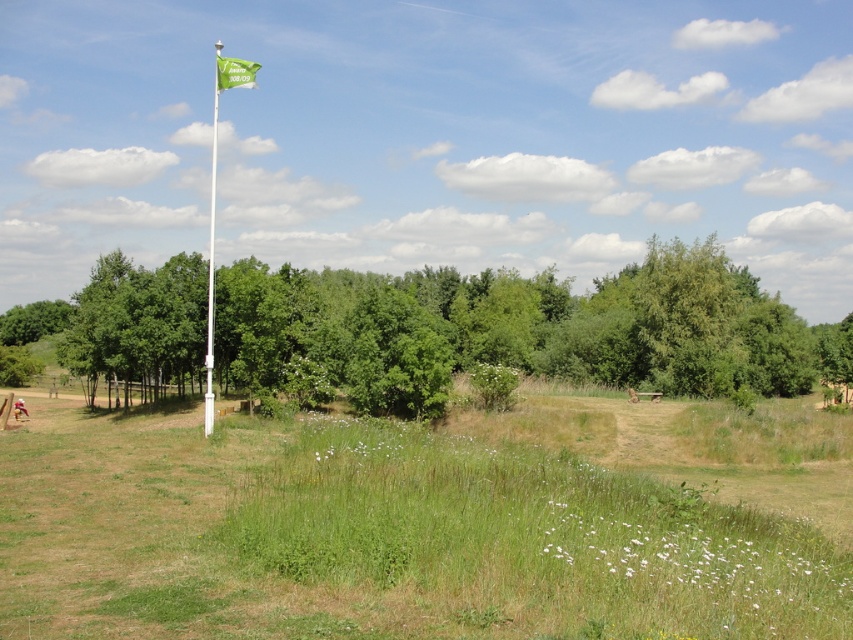
Question: Which object appears farthest from the camera in this image?

Choices:
 (A) white plastic flag pole at center
 (B) green leafy tree at center
 (C) green grass at center

Answer: (B)

Question: In this image, where is white plastic flag pole at center located relative to green fabric flag at upper center?

Choices:
 (A) left
 (B) right

Answer: (A)

Question: Is green grass at center behind white plastic flag pole at center?

Choices:
 (A) yes
 (B) no

Answer: (B)

Question: Which object appears closest to the camera in this image?

Choices:
 (A) white plastic flag pole at center
 (B) green grass at center
 (C) green fabric flag at upper center
 (D) green leafy tree at center

Answer: (B)

Question: Which is nearer to the green leafy tree at center?

Choices:
 (A) green grass at center
 (B) white plastic flag pole at center
 (C) green fabric flag at upper center

Answer: (A)

Question: Does green grass at center appear on the left side of white plastic flag pole at center?

Choices:
 (A) yes
 (B) no

Answer: (B)